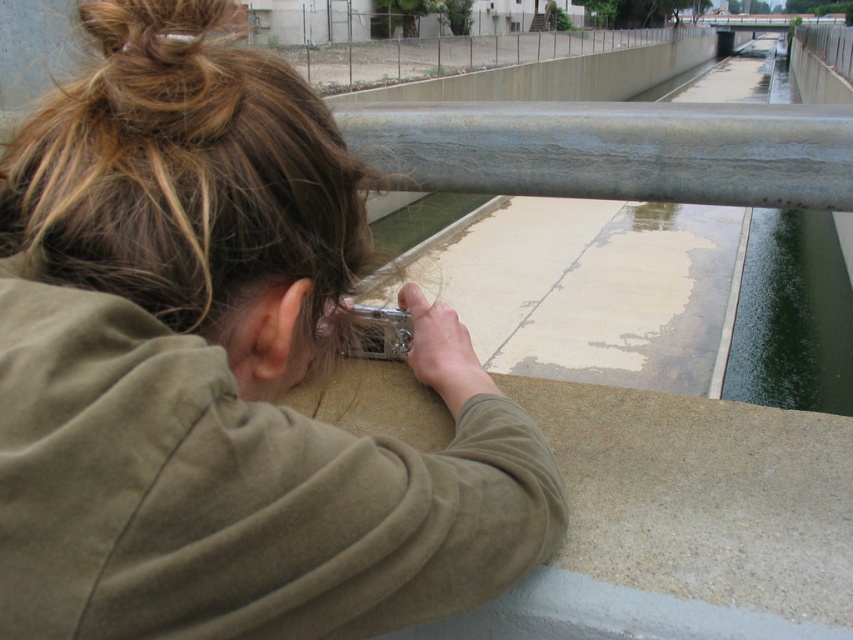
Does point (729, 316) come in front of point (577, 36)?

Yes.

I want to click on green smooth water at upper right, so click(x=788, y=314).

Where is `green smooth water at upper right`? This screenshot has height=640, width=853. green smooth water at upper right is located at coordinates (788, 314).

At what (x,y) coordinates should I click in order to perform the action: click on green smooth water at upper right. Please return your answer as a coordinate pair (x, y). Looking at the image, I should click on (788, 314).

Between matte silver camera at upper left and concrete fence at upper center, which one appears on the left side from the viewer's perspective?

matte silver camera at upper left is more to the left.

Can you confirm if matte silver camera at upper left is wider than concrete fence at upper center?

Incorrect, matte silver camera at upper left's width does not surpass concrete fence at upper center's.

Who is more forward, (126, 202) or (357, 42)?

Point (126, 202)

The image size is (853, 640). What are the coordinates of `matte silver camera at upper left` in the screenshot? It's located at (222, 369).

Is brownhair at left to the right of concrete fence at upper center from the viewer's perspective?

Incorrect, brownhair at left is not on the right side of concrete fence at upper center.

Between point (18, 148) and point (592, 52), which one is positioned behind?

The point (592, 52) is more distant.

Find the location of `brownhair at left`. brownhair at left is located at coordinates (192, 189).